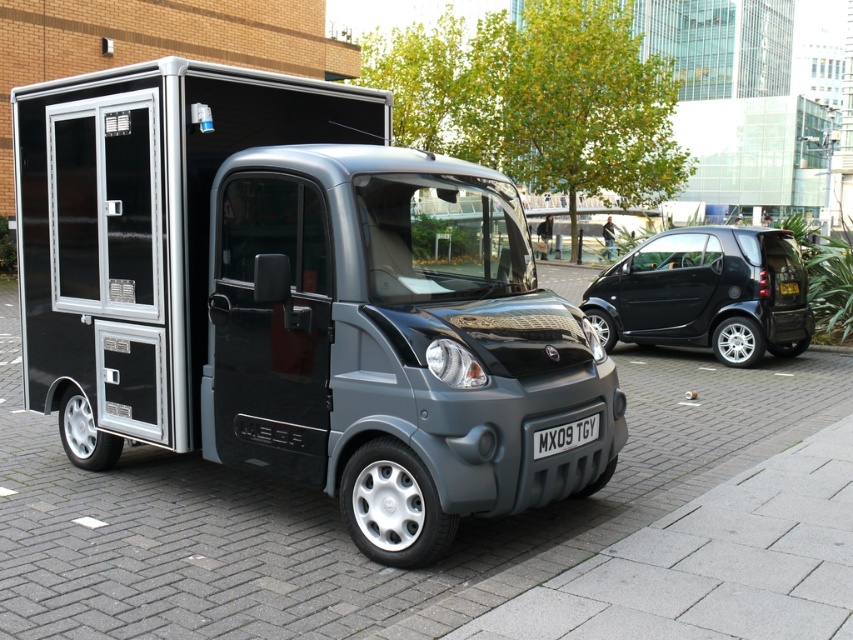
Question: Is matte black van at center thinner than shiny black car at right?

Choices:
 (A) no
 (B) yes

Answer: (A)

Question: Is shiny black car at right above white plastic license plate at center?

Choices:
 (A) no
 (B) yes

Answer: (B)

Question: Which object appears closest to the camera in this image?

Choices:
 (A) matte black van at center
 (B) white plastic license plate at center

Answer: (A)

Question: Is matte black van at center to the right of shiny black car at right from the viewer's perspective?

Choices:
 (A) yes
 (B) no

Answer: (B)

Question: Which point is closer to the camera?

Choices:
 (A) matte black van at center
 (B) shiny black car at right

Answer: (A)

Question: Which of the following is the farthest from the observer?

Choices:
 (A) matte black van at center
 (B) shiny black car at right

Answer: (B)